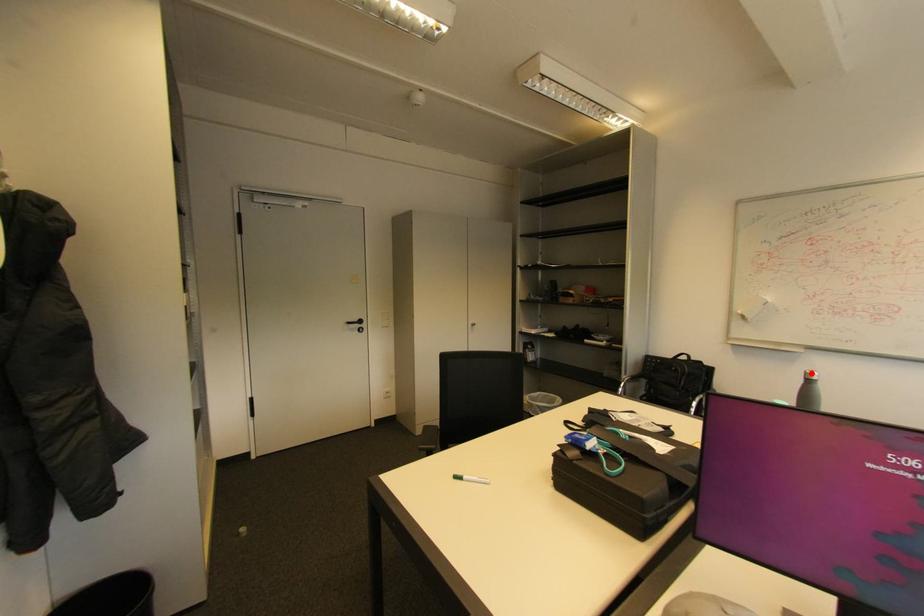
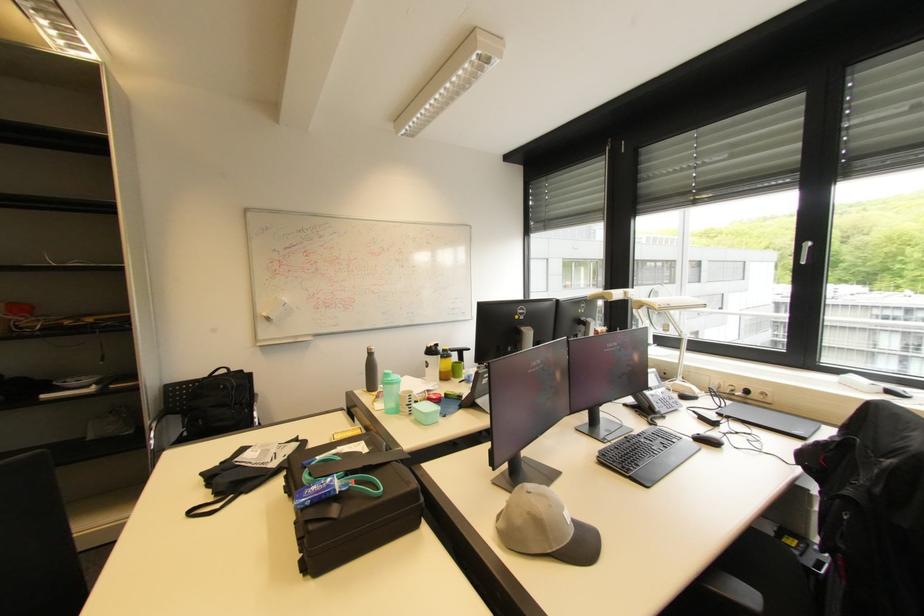
Question: I am providing you with two images of the same scene from different viewpoints. A red point is marked on the first image. At the location where the point appears in image 1, is it still visible in image 2?

Choices:
 (A) Yes
 (B) No

Answer: (A)